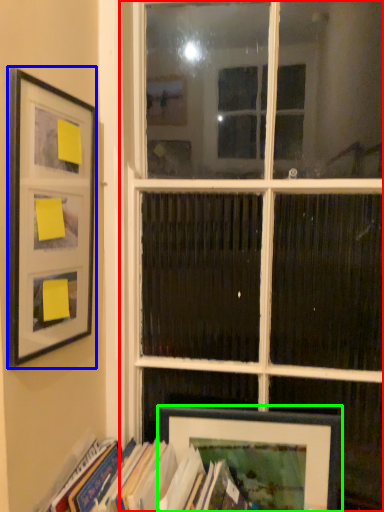
Question: Which is farther away from window (highlighted by a red box)? picture frame (highlighted by a blue box) or picture frame (highlighted by a green box)?

Choices:
 (A) picture frame
 (B) picture frame

Answer: (A)